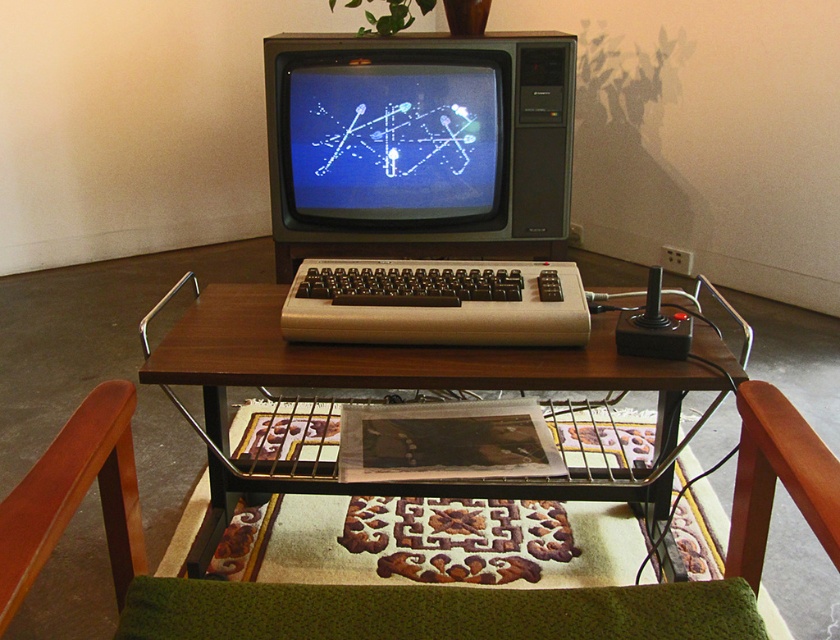
You are a game developer examining a retro gaming setup. You notice the matte black computer at center and the wooden table at center. Which object is closer to you?

The matte black computer at center is closer to you than the wooden table at center.

You are setting up a new gaming station and have both a matte black computer at center and a wooden table at center. According to the setup, which object is positioned to the left?

The matte black computer at center is to the left of the wooden table at center.

You are setting up a new gaming station and want to place a new controller exactly where the matte black computer at center is currently located. What coordinates should you use to place the new controller?

The coordinates for the matte black computer at center are at point (424,188), so you should place the new controller at those coordinates.